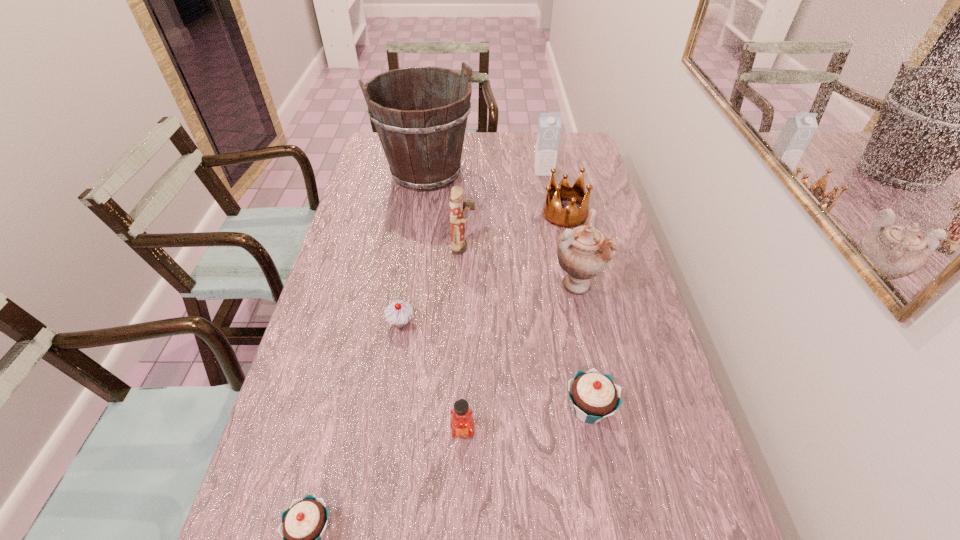
This screenshot has width=960, height=540. In order to click on urn that is at the right edge in this screenshot , I will do `click(583, 252)`.

The width and height of the screenshot is (960, 540). What are the coordinates of `crown that is at the right edge` in the screenshot? It's located at (552, 211).

Locate an element on the screen. The image size is (960, 540). cupcake located in the right edge section of the desktop is located at coordinates (594, 396).

The image size is (960, 540). I want to click on object located in the far left corner section of the desktop, so click(x=422, y=135).

In the image, there is a desktop. Where is `vacant area at the far edge`? vacant area at the far edge is located at coordinates (531, 143).

The width and height of the screenshot is (960, 540). Find the location of `vacant space at the left edge of the desktop`. vacant space at the left edge of the desktop is located at coordinates (352, 233).

In the image, there is a desktop. Identify the location of vacant space at the right edge. The image size is (960, 540). (608, 211).

Where is `vacant position at the far right corner of the desktop`? vacant position at the far right corner of the desktop is located at coordinates (580, 132).

Identify the location of free space between the crown and the figurine. The height and width of the screenshot is (540, 960). (515, 231).

Where is `free space that is in between the tallest object and the second cupcake from right to left`? Image resolution: width=960 pixels, height=540 pixels. free space that is in between the tallest object and the second cupcake from right to left is located at coordinates (414, 248).